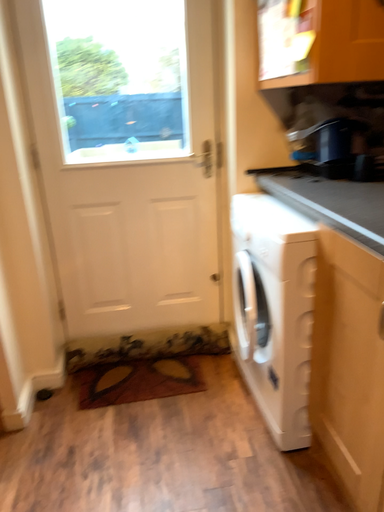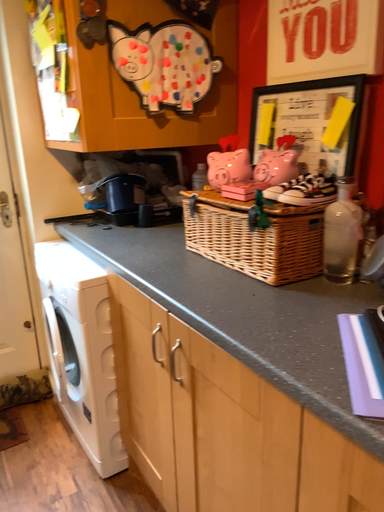
Question: Which way did the camera rotate in the video?

Choices:
 (A) rotated left
 (B) rotated right

Answer: (B)